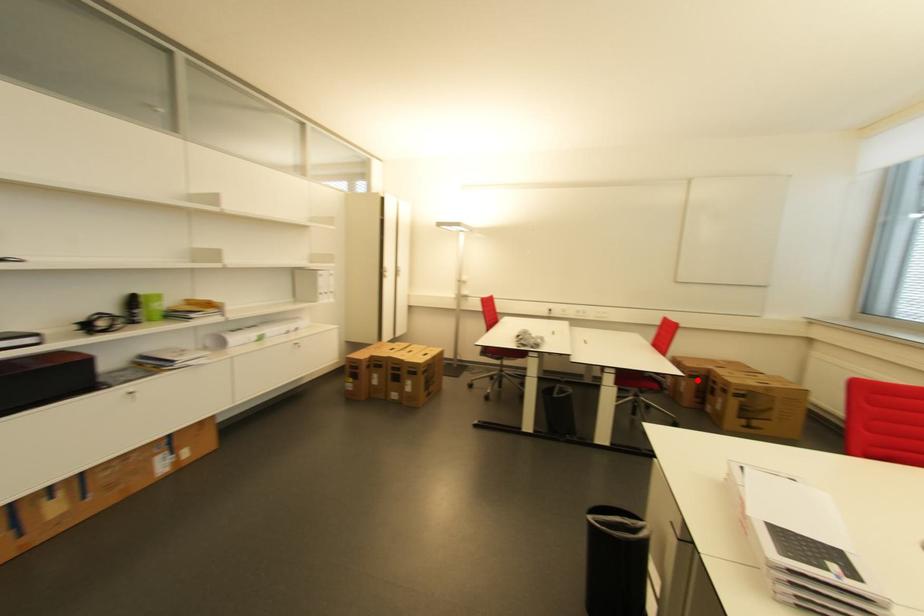
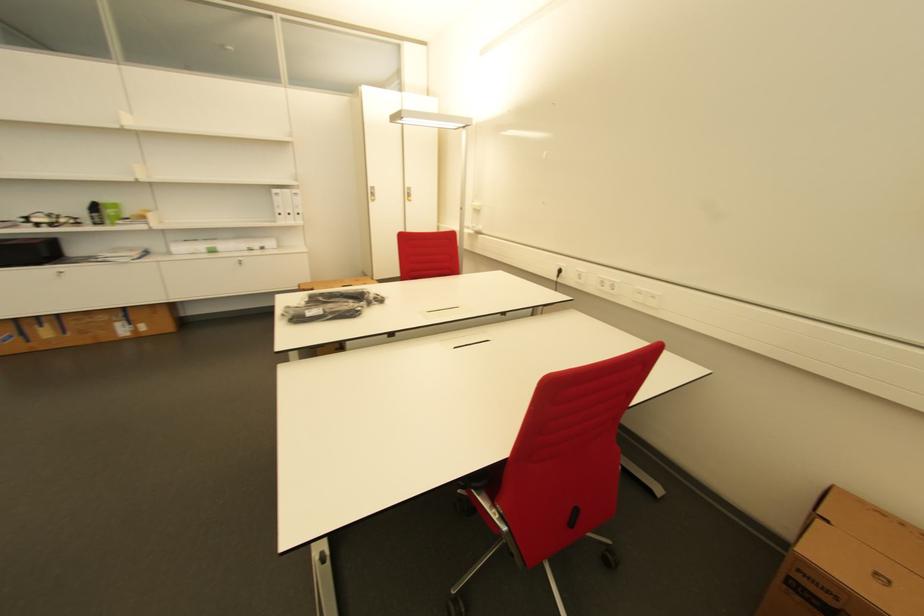
Question: I am providing you with two images of the same scene from different viewpoints. A red point is marked on the first image. Is the red point's position out of view in image 2?

Choices:
 (A) Yes
 (B) No

Answer: (B)